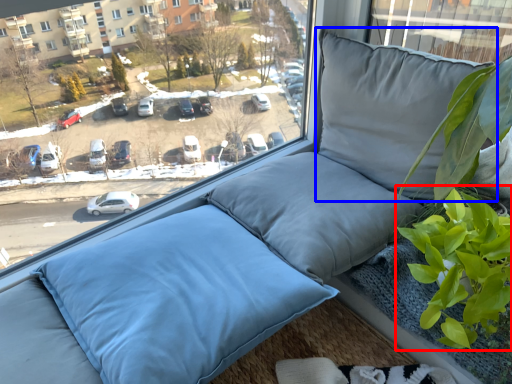
Question: Among these objects, which one is nearest to the camera, vegetation (highlighted by a red box) or pillow (highlighted by a blue box)?

Choices:
 (A) vegetation
 (B) pillow

Answer: (A)